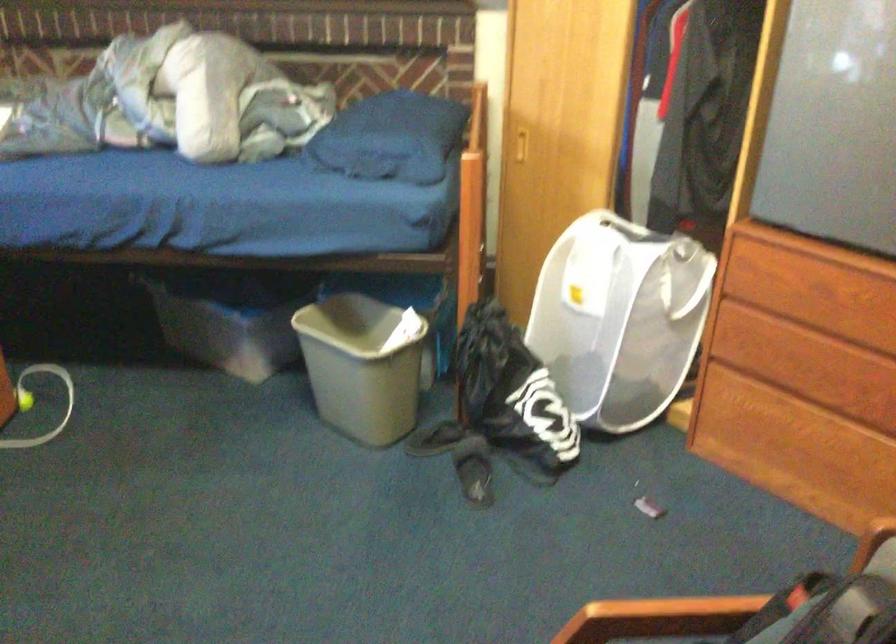
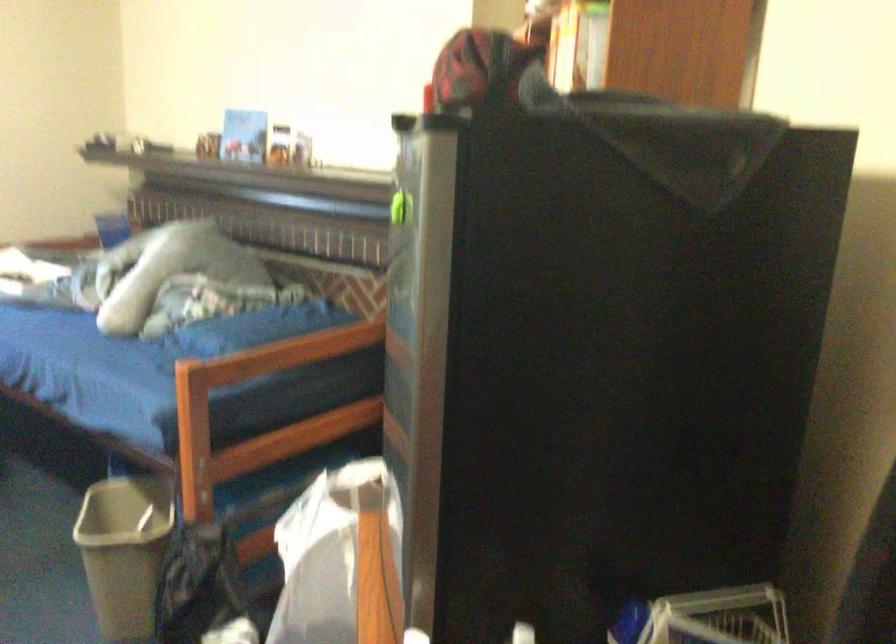
Question: I am providing you with two images of the same scene from different viewpoints. Please identify which objects are invisible in image2.

Choices:
 (A) glass and metal lantern
 (B) dresser drawer handle
 (C) red and black cap
 (D) green magnetic clip

Answer: (B)